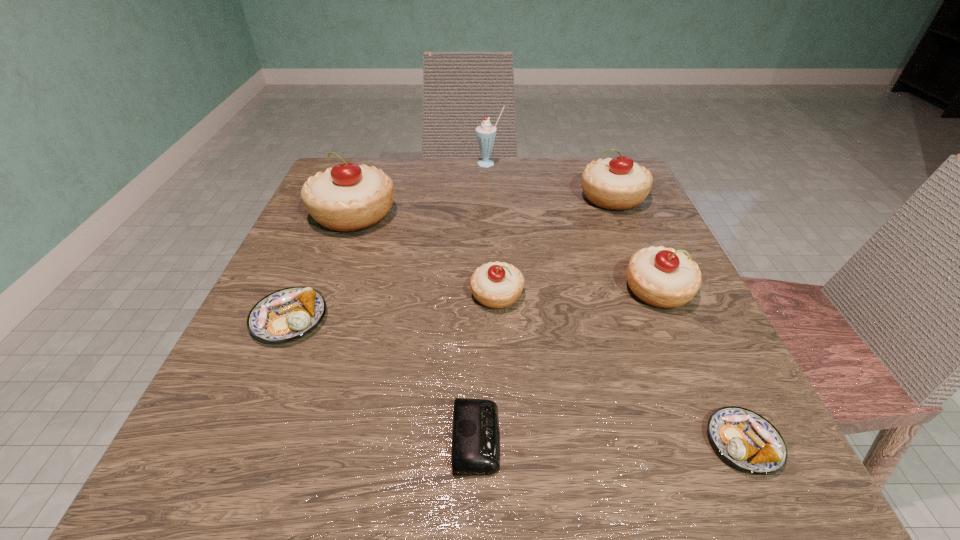
This screenshot has width=960, height=540. Find the location of `free space that satisfies the following two spatial constraints: 1. on the straw side of the milkshake; 2. on the left side of the second biggest beige pastry`. free space that satisfies the following two spatial constraints: 1. on the straw side of the milkshake; 2. on the left side of the second biggest beige pastry is located at coordinates pyautogui.click(x=491, y=197).

I want to click on free space that satisfies the following two spatial constraints: 1. on the front side of the sixth shortest object; 2. on the display of the shortest object, so click(x=712, y=438).

The width and height of the screenshot is (960, 540). Identify the location of free space that satisfies the following two spatial constraints: 1. on the straw side of the farthest object; 2. on the right side of the third tallest object. (491, 197).

In order to click on free location that satisfies the following two spatial constraints: 1. on the back side of the biggest beige pastry; 2. on the right side of the third tallest object in this screenshot , I will do `click(360, 197)`.